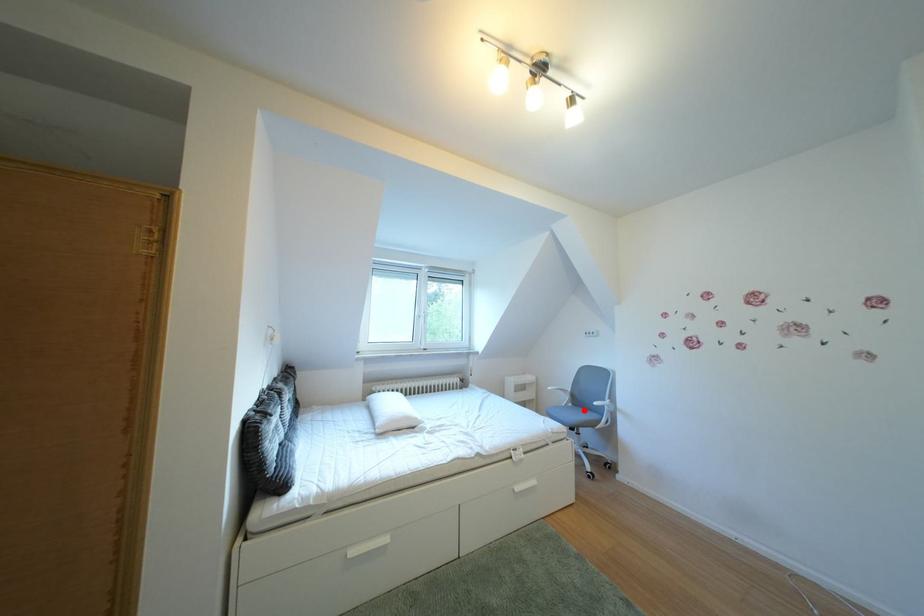
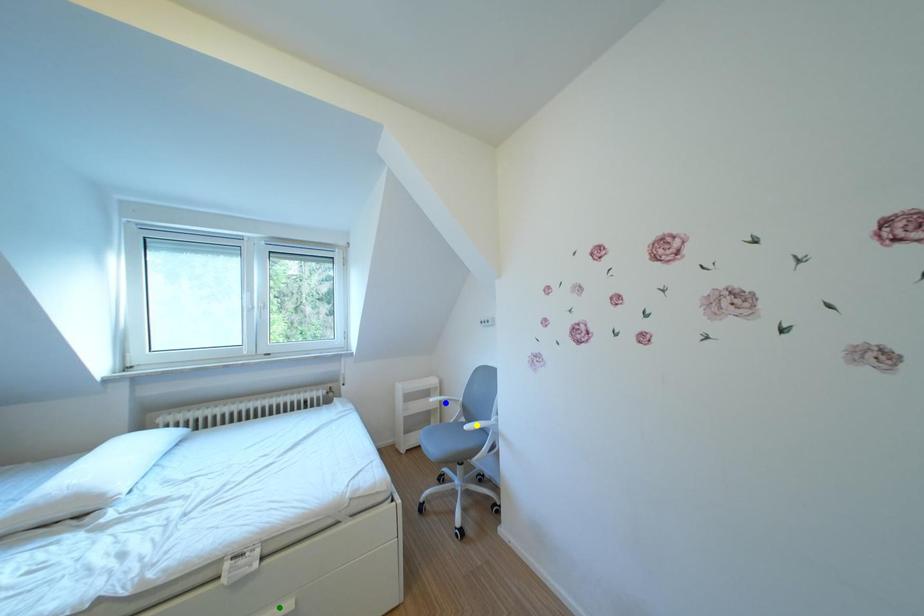
Question: I am providing you with two images of the same scene from different viewpoints. A red point is marked on the first image. You are given multiple points on the second image. Which point in image 2 is actually the same real-world point as the red point in image 1?

Choices:
 (A) green point
 (B) yellow point
 (C) blue point

Answer: (B)